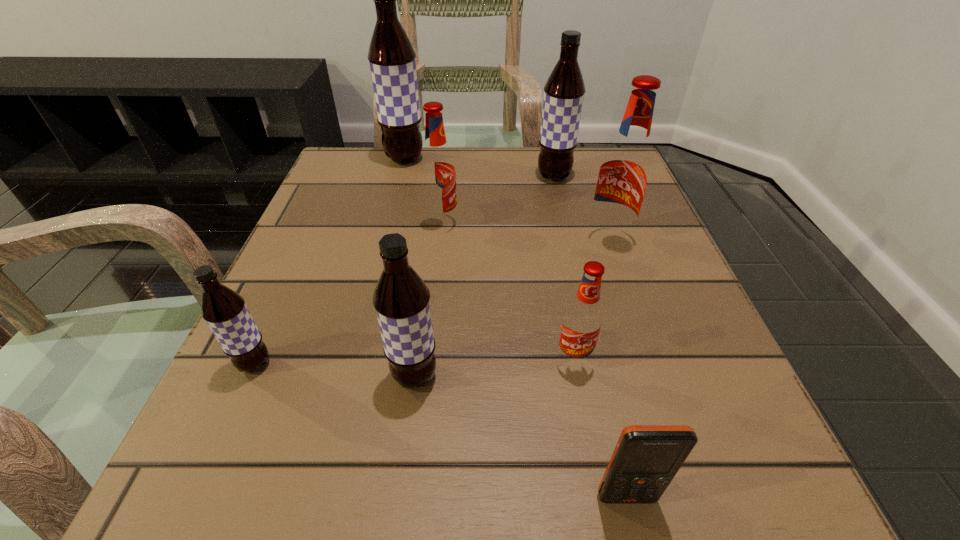
This screenshot has height=540, width=960. I want to click on the tallest object, so click(x=391, y=56).

The width and height of the screenshot is (960, 540). I want to click on the biggest brown root beer, so click(x=391, y=56).

At what (x,y) coordinates should I click in order to perform the action: click on the third smallest brown root beer. Please return your answer as a coordinate pair (x, y). Looking at the image, I should click on (564, 91).

I want to click on the biggest red root beer, so click(623, 177).

This screenshot has width=960, height=540. I want to click on the leftmost red root beer, so click(x=437, y=170).

The height and width of the screenshot is (540, 960). In order to click on the third biggest brown root beer in this screenshot , I will do `click(401, 299)`.

This screenshot has height=540, width=960. What are the coordinates of `the nearest red root beer` in the screenshot? It's located at (582, 321).

This screenshot has height=540, width=960. Identify the location of the second red root beer from left to right. (582, 321).

Where is `the leftmost brown root beer`? The image size is (960, 540). the leftmost brown root beer is located at coordinates (224, 310).

This screenshot has width=960, height=540. I want to click on the smallest brown root beer, so click(x=224, y=310).